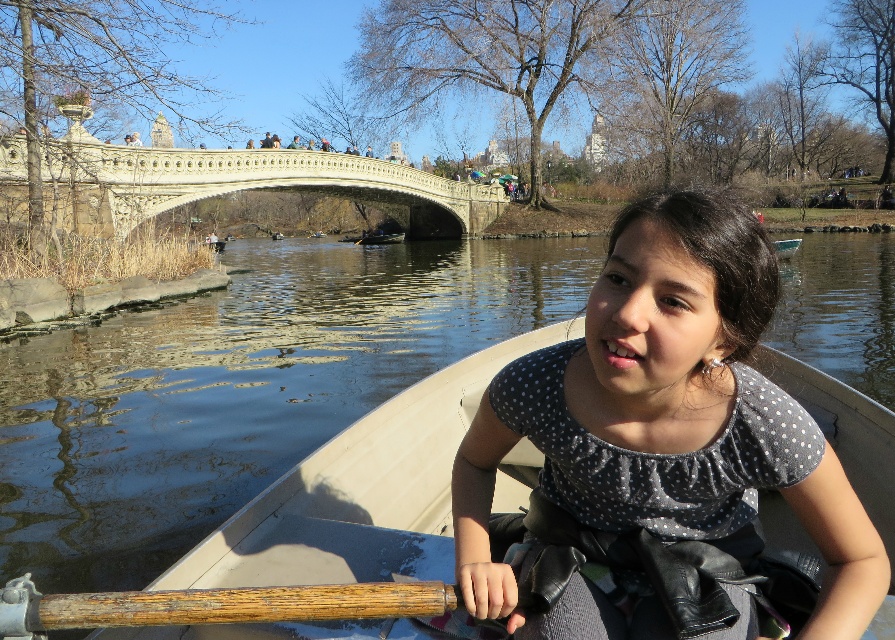
You are a photographer aiming to capture the white stone bridge at upper center and the wooden textured paddle at lower left in the same frame. Can you position yourself so that the paddle is not blocking the view of the bridge?

The wooden textured paddle at lower left is behind the white stone bridge at upper center, so positioning yourself in a way that the paddle is not blocking the bridge might be challenging. Since the paddle is behind the bridge, it won not obstruct the view of the bridge in the frame.

In the scene shown: You are a tourist standing on the path near the water and want to take a photo of the white stone bridge at upper center and the polka dot fabric shirt at center. Which object should you focus on first to ensure both are in the frame?

You should focus on the white stone bridge at upper center first because the polka dot fabric shirt at center is below it, so adjusting the camera to include the higher bridge will naturally include the lower shirt in the frame.

In the scene shown: You are standing at the point labeled as point (282, 170) in the image, which is 203.95 feet away from you. If you want to reach the Bow Bridge in the background, which is beyond the point, should you walk towards the bridge or away from it?

Since the point (282, 170) is 203.95 feet away from you, and the Bow Bridge is in the background beyond that point, you should walk towards the bridge to reach it.